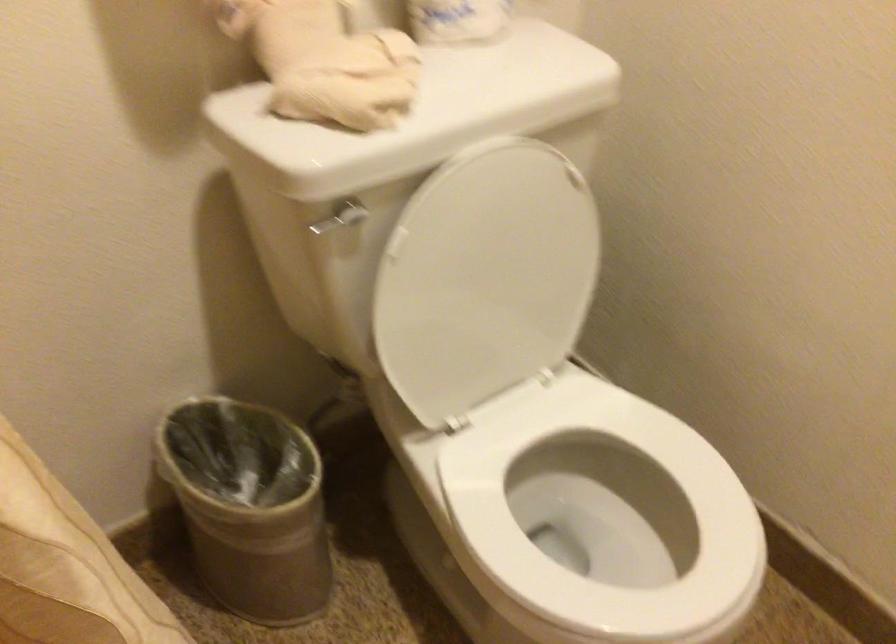
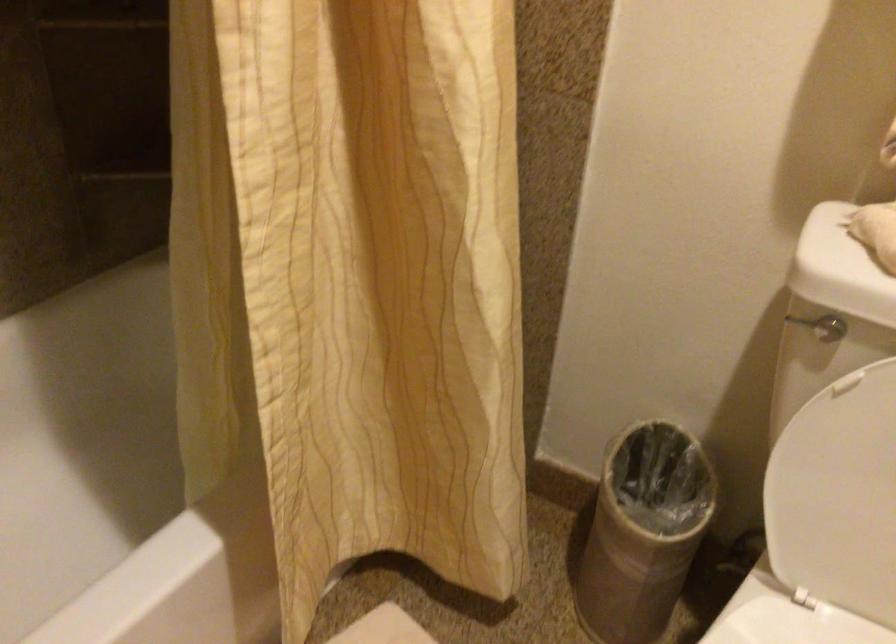
Where in the second image is the point corresponding to pixel 297 506 from the first image?

(643, 532)